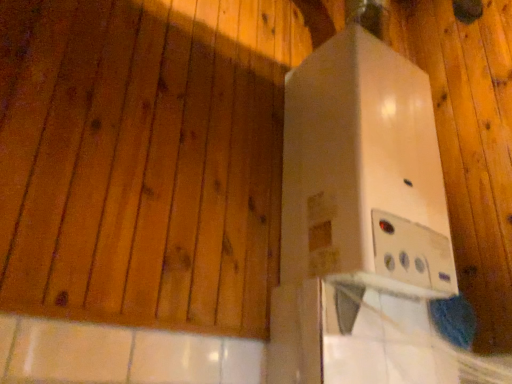
You are a GUI agent. You are given a task and a screenshot of the screen. Output one action in this format:
    pyautogui.click(x=<x>, y=<y>)
    Task: Click on the white glossy boiler at upper right
    
    Given the screenshot: What is the action you would take?
    pyautogui.click(x=360, y=221)

The image size is (512, 384). Describe the element at coordinates (360, 221) in the screenshot. I see `white glossy boiler at upper right` at that location.

Locate an element on the screen. Image resolution: width=512 pixels, height=384 pixels. white glossy boiler at upper right is located at coordinates (360, 221).